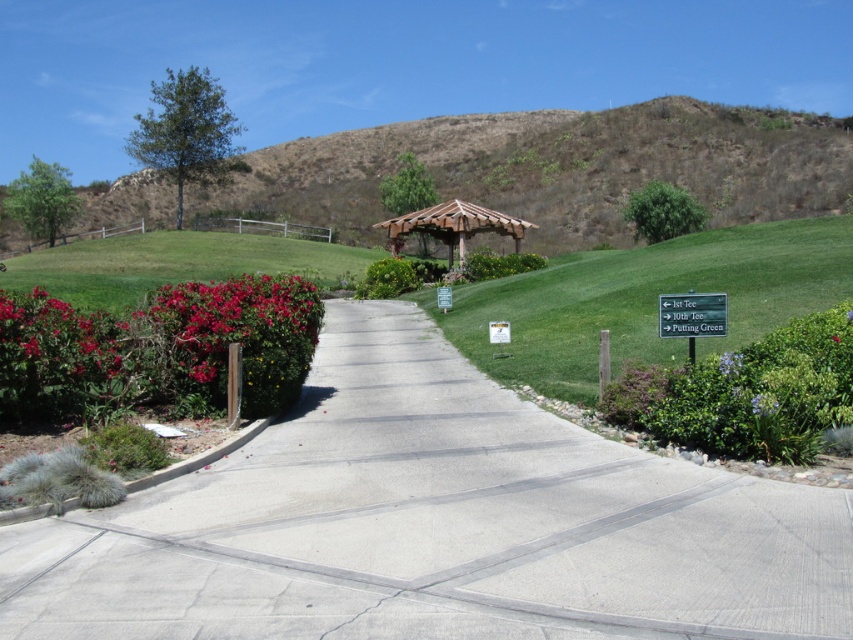
Question: Can you confirm if brown grassy hillside at upper center is wider than purple matte flower at center-right?

Choices:
 (A) no
 (B) yes

Answer: (B)

Question: Is brown grassy hillside at upper center thinner than green grass at center?

Choices:
 (A) yes
 (B) no

Answer: (B)

Question: Which object is positioned closest to the wooden gazebo at center?

Choices:
 (A) gray concrete pavement at center
 (B) green plastic sign at center right
 (C) green leafy bush at upper center
 (D) green grass at center

Answer: (D)

Question: Can you confirm if green grass at center is positioned above wooden gazebo at center?

Choices:
 (A) yes
 (B) no

Answer: (B)

Question: Which point is closer to the camera?

Choices:
 (A) brown grassy hillside at upper center
 (B) glossy red flowers at left

Answer: (B)

Question: Which object is the farthest from the green plastic sign at center right?

Choices:
 (A) brown grassy hillside at upper center
 (B) glossy red flowers at left

Answer: (A)